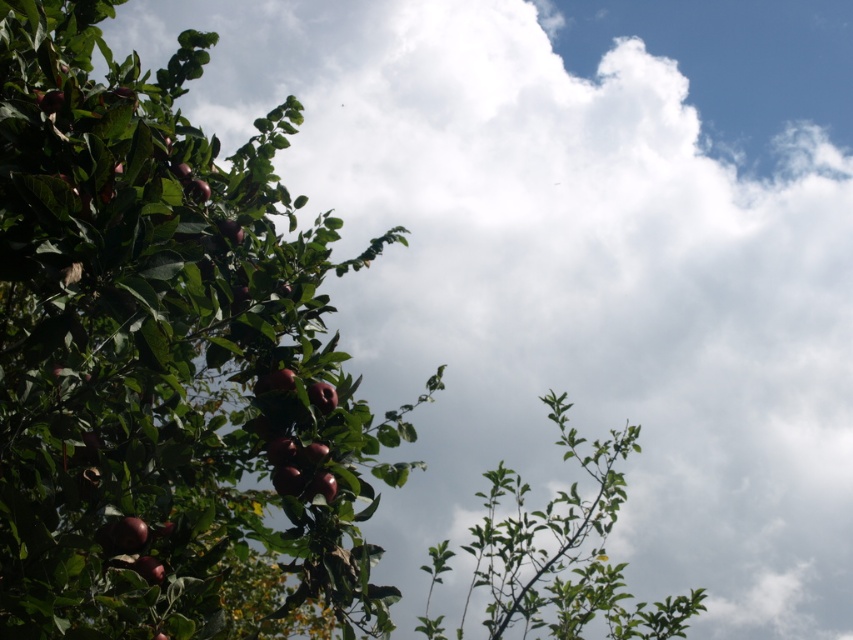
You are an apple picker standing at the base of the tree. You see the glossy red apples at left and the green leafy branch at center. Which object is closer to you?

The glossy red apples at left are closer to you than the green leafy branch at center, as they are only 4.65 feet away from each other.

You are an apple picker standing at the right side of the tree. You see the glossy red apples at left and the green leafy branch at center. Which object is closer to your current position?

The green leafy branch at center is closer to your current position because it is positioned to the right of the glossy red apples at left, and you are standing at the right side of the tree.

You are standing in front of the tree with apples and want to pick the apple at point (589, 531). However, there is an obstacle at point (27, 541). Which point is closer to you, the obstacle or the apple?

The obstacle at point (27, 541) is closer to you than the apple at point (589, 531).